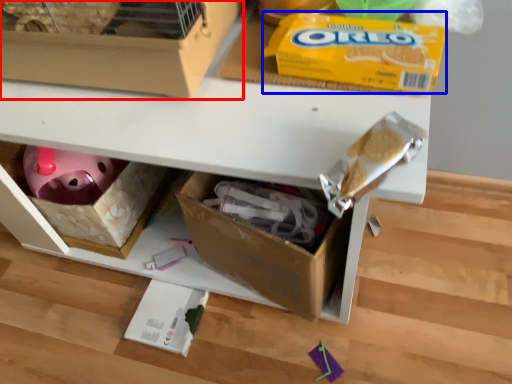
Question: Among these objects, which one is farthest to the camera, box (highlighted by a red box) or cereal (highlighted by a blue box)?

Choices:
 (A) box
 (B) cereal

Answer: (B)